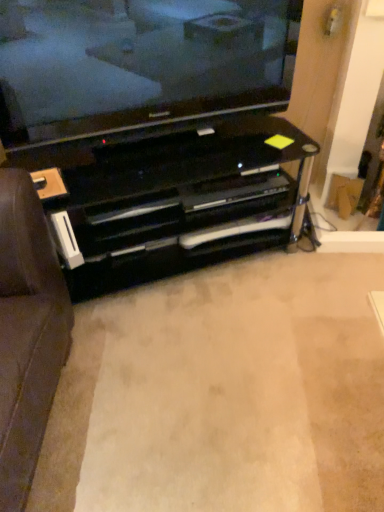
You are a GUI agent. You are given a task and a screenshot of the screen. Output one action in this format:
    pyautogui.click(x=<x>, y=<y>)
    Task: Click on the free space on the front side of black glossy entertainment center at center
    The height and width of the screenshot is (512, 384).
    Given the screenshot: What is the action you would take?
    pyautogui.click(x=188, y=376)